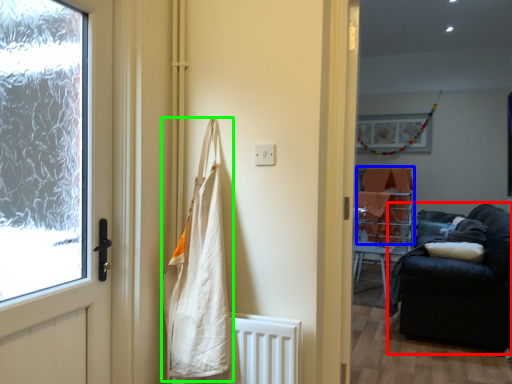
Question: Estimate the real-world distances between objects in this image. Which object is farther from studio couch (highlighted by a red box), blanket (highlighted by a blue box) or shopping bag (highlighted by a green box)?

Choices:
 (A) blanket
 (B) shopping bag

Answer: (B)